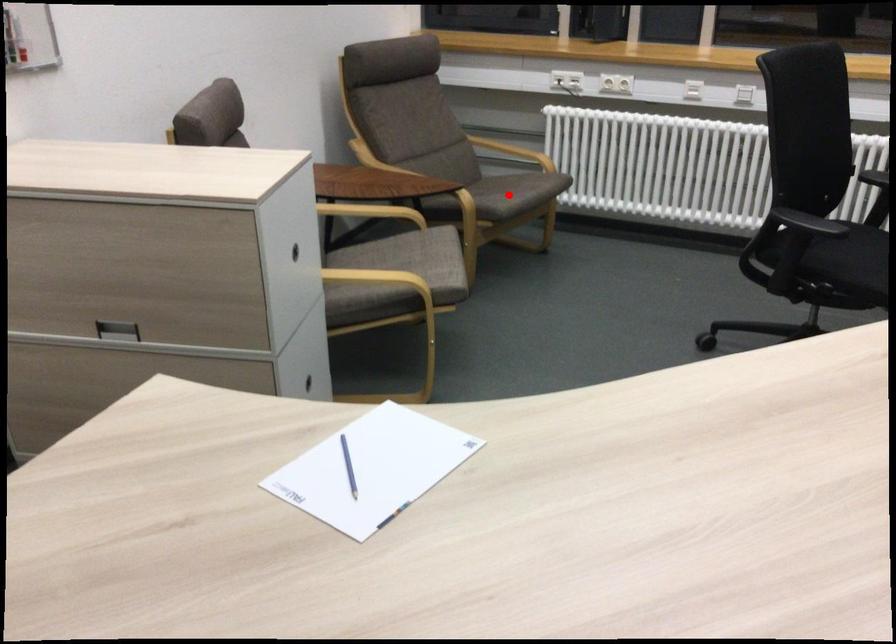
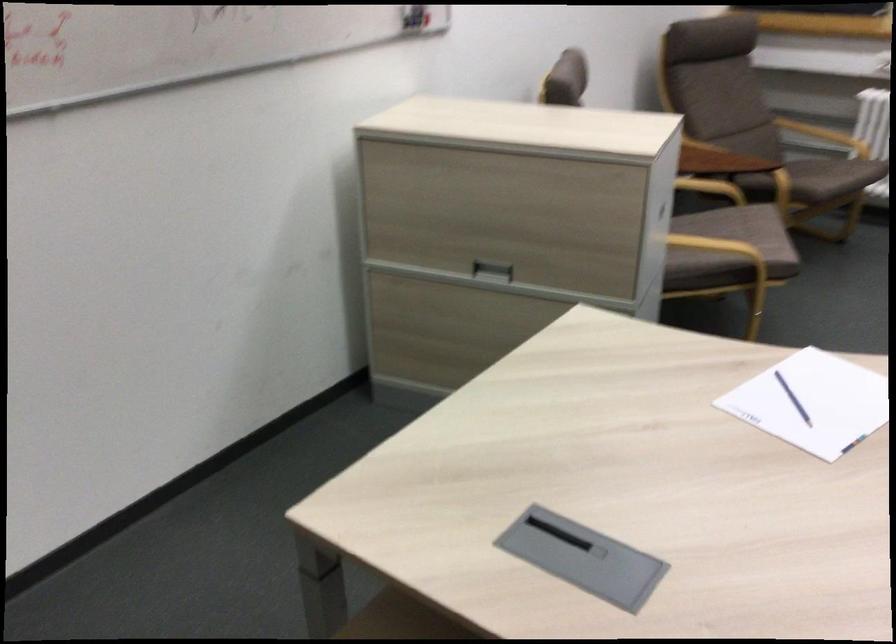
In the second image, find the point that corresponds to the highlighted location in the first image.

(831, 176)